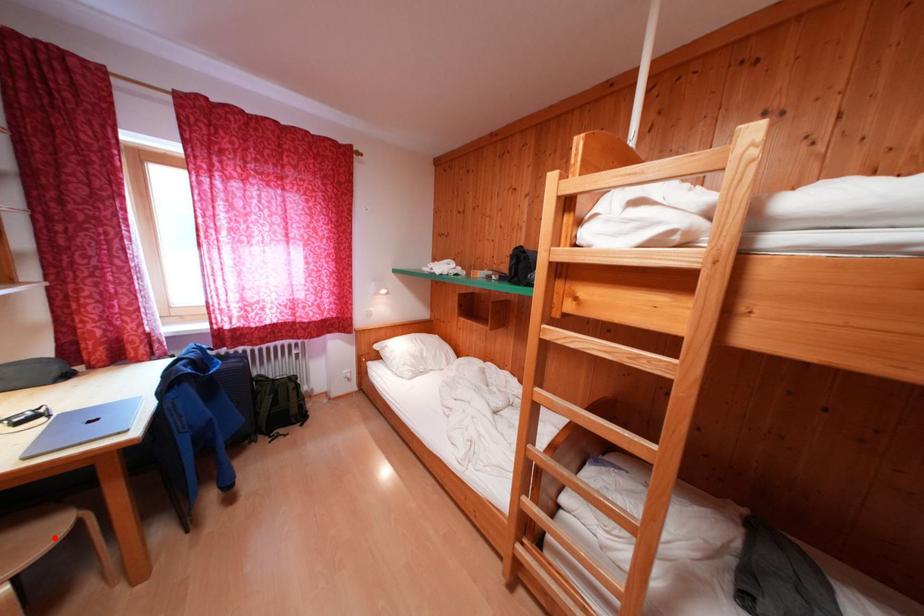
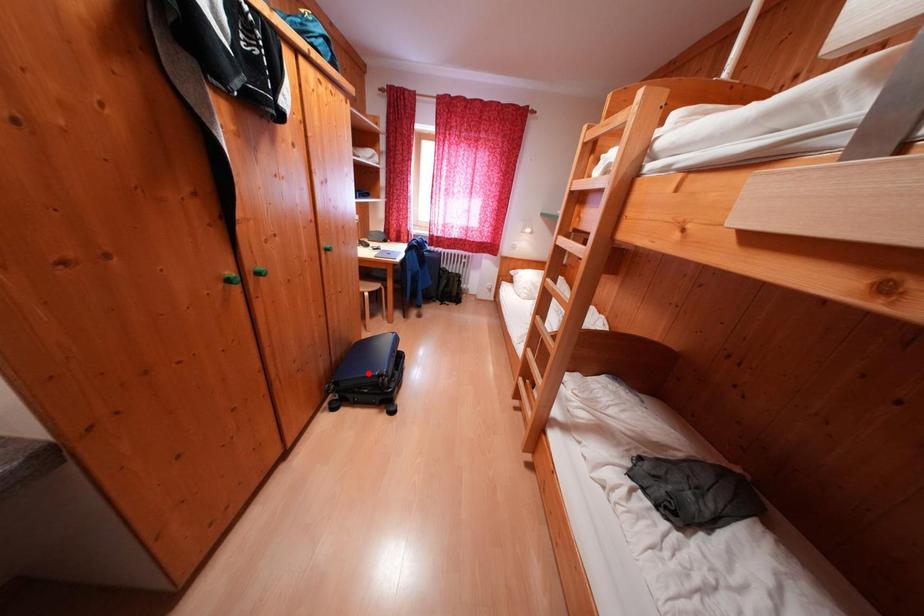
I am providing you with two images of the same scene from different viewpoints. A red point is marked on the first image and another point is marked on the second image. Is the marked point in image1 the same physical position as the marked point in image2?

No